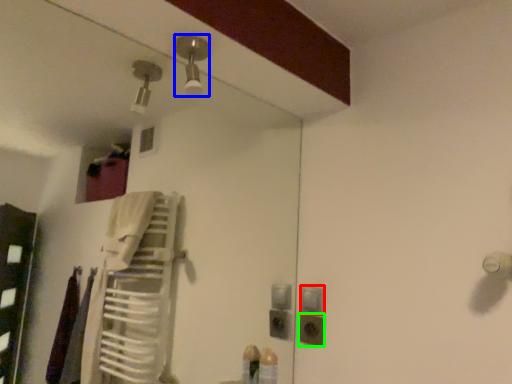
Question: Estimate the real-world distances between objects in this image. Which object is closer to light switch (highlighted by a red box), light fixture (highlighted by a blue box) or electric outlet (highlighted by a green box)?

Choices:
 (A) light fixture
 (B) electric outlet

Answer: (B)